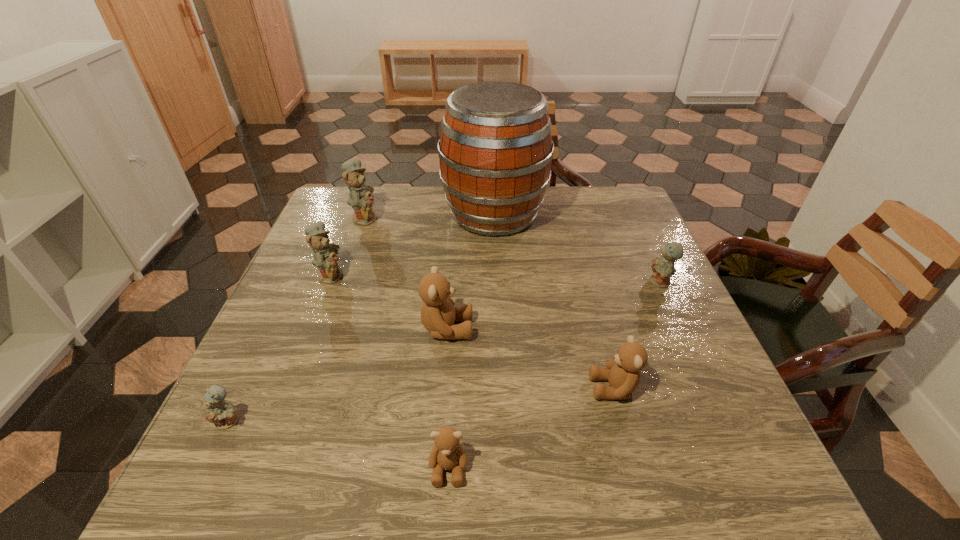
You are a GUI agent. You are given a task and a screenshot of the screen. Output one action in this format:
    pyautogui.click(x=<x>, y=<y>)
    Task: Click on the free space at the near edge of the desktop
    The height and width of the screenshot is (540, 960).
    Given the screenshot: What is the action you would take?
    pyautogui.click(x=415, y=459)

This screenshot has height=540, width=960. Identify the location of free space at the left edge of the desktop. (245, 394).

You are a GUI agent. You are given a task and a screenshot of the screen. Output one action in this format:
    pyautogui.click(x=<x>, y=<y>)
    Task: Click on the free region at the right edge of the desktop
    The image size is (960, 540).
    Given the screenshot: What is the action you would take?
    pyautogui.click(x=610, y=254)

This screenshot has width=960, height=540. I want to click on vacant space at the far left corner of the desktop, so click(x=339, y=214).

Where is `vacant space at the near left corner`? This screenshot has width=960, height=540. vacant space at the near left corner is located at coordinates (183, 497).

Where is `vacant space at the near right corner`? vacant space at the near right corner is located at coordinates (735, 464).

I want to click on free space between the sixth farthest object and the third biggest blue teddy bear, so click(x=637, y=335).

Locate an element on the screen. The height and width of the screenshot is (540, 960). vacant space that is in between the third smallest blue teddy bear and the smallest brown teddy bear is located at coordinates point(390,371).

The width and height of the screenshot is (960, 540). In order to click on vacant point located between the second biggest blue teddy bear and the leftmost teddy bear in this screenshot , I will do `click(280, 348)`.

This screenshot has height=540, width=960. Find the location of `unoccupied area between the fourth nearest object and the leftmost teddy bear`. unoccupied area between the fourth nearest object and the leftmost teddy bear is located at coordinates (338, 375).